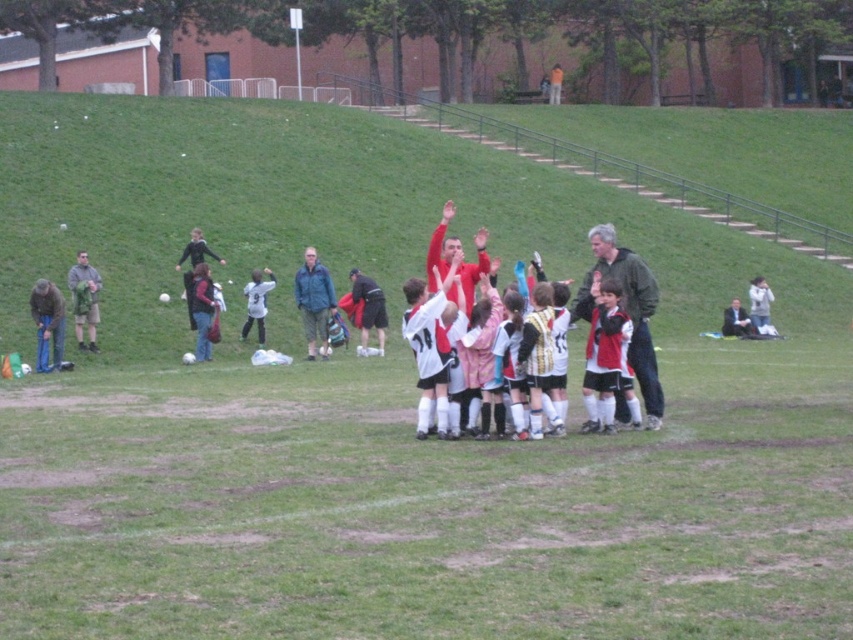
You are a soccer coach standing at the point with coordinates point (244, 321). You want to give instructions to the player at point (352, 284). Which direction should you move to face them directly?

Since point (352, 284) is behind point (244, 321), you should move backward to face the player at point (352, 284) directly.

You are a photographer standing at the center of the field. You want to take a photo that includes both the point at coordinates point (86,296) and point (216,310). Which point should you focus on first to ensure both are in the frame?

You should focus on point (86,296) first because it is closer to you than point (216,310), ensuring both points remain within the camera frame.